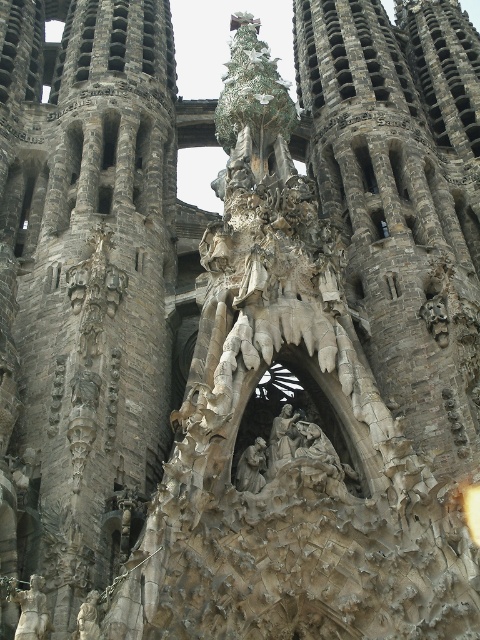
You are an art student analyzing the Sagrada Familia statues. You observe the gray stone statue at center and the matte stone statue at center. Which statue has a greater width?

The gray stone statue at center has a greater width than the matte stone statue at center as stated in the description.

You are standing inside the Sagrada Familia and want to take a photo of the intricate carvings around the large arched window. You notice two points marked in the scene. The first point is at coordinates point [21,632], and the second is at point [250,476]. Which of these points is closer to you, the observer?

Point [21,632] is in front of point [250,476], so it is closer to you.